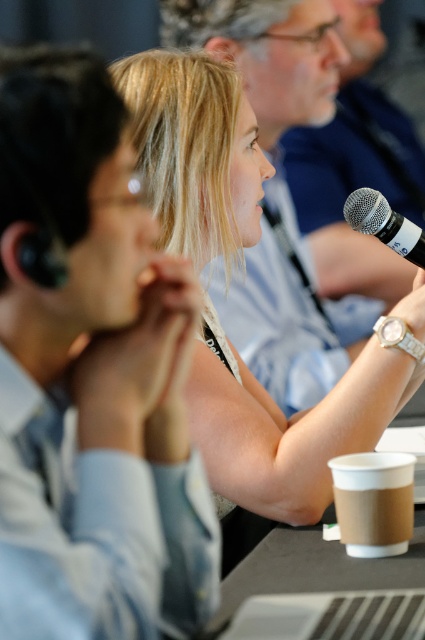
Question: Does smooth skin woman at center appear under brown paper cup at lower right?

Choices:
 (A) yes
 (B) no

Answer: (B)

Question: Can you confirm if brown paper cup at lower right is bigger than silver metallic microphone at upper right?

Choices:
 (A) yes
 (B) no

Answer: (B)

Question: Which object is closer to the camera taking this photo?

Choices:
 (A) brown paper cup at lower right
 (B) silver metallic microphone at upper right

Answer: (A)

Question: Which point is closer to the camera taking this photo?

Choices:
 (A) (368, 227)
 (B) (380, 540)
 (C) (201, 157)

Answer: (B)

Question: Which point is closer to the camera?

Choices:
 (A) (377, 237)
 (B) (136, 124)
 (C) (376, 516)

Answer: (C)

Question: Is smooth skin woman at center to the left of silver metallic microphone at upper right from the viewer's perspective?

Choices:
 (A) no
 (B) yes

Answer: (B)